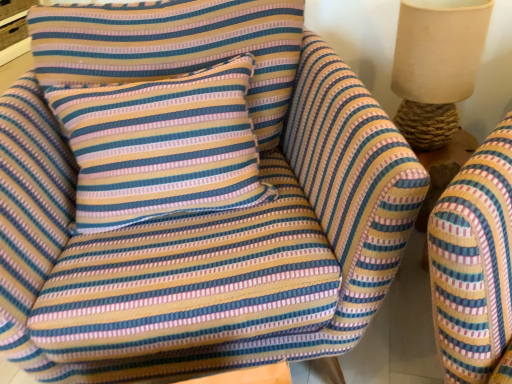
Question: Is striped fabric pillow at center inside the boundaries of burlap lampshade at upper right, or outside?

Choices:
 (A) inside
 (B) outside

Answer: (B)

Question: From the image's perspective, is striped fabric pillow at center positioned above or below burlap lampshade at upper right?

Choices:
 (A) above
 (B) below

Answer: (B)

Question: Considering the positions of point (146, 208) and point (452, 36), is point (146, 208) closer or farther from the camera than point (452, 36)?

Choices:
 (A) farther
 (B) closer

Answer: (A)

Question: From a real-world perspective, is burlap lampshade at upper right positioned above or below striped fabric pillow at center?

Choices:
 (A) below
 (B) above

Answer: (B)

Question: Considering the positions of point 430,74 and point 192,97, is point 430,74 closer or farther from the camera than point 192,97?

Choices:
 (A) farther
 (B) closer

Answer: (A)

Question: Looking at their shapes, would you say burlap lampshade at upper right is wider or thinner than striped fabric pillow at center?

Choices:
 (A) thin
 (B) wide

Answer: (A)

Question: Relative to striped fabric pillow at center, is burlap lampshade at upper right in front or behind?

Choices:
 (A) behind
 (B) front

Answer: (A)